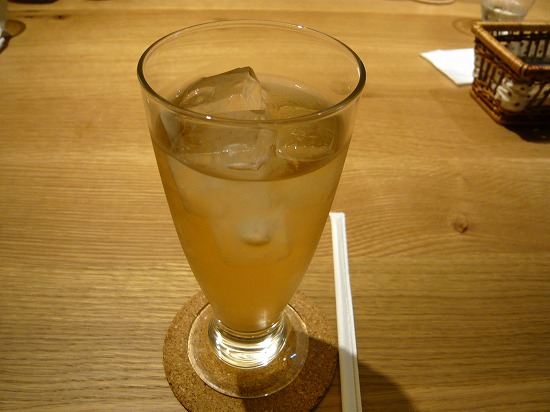
Identify the location of pedestal. The image size is (550, 412). (236, 357).